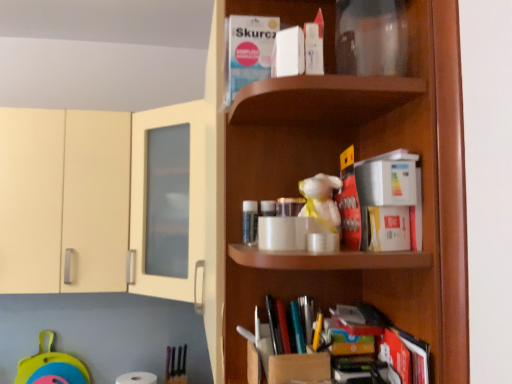
Question: Is white matte book at upper center, which is counted as the 1th book, starting from the top, shorter than multicolored plastic books at lower center, marked as the 3th book in a right-to-left arrangement?

Choices:
 (A) yes
 (B) no

Answer: (B)

Question: Could multicolored plastic books at lower center, the 4th book when ordered from top to bottom, be considered to be inside white matte book at upper center, positioned as the fifth book in bottom-to-top order?

Choices:
 (A) yes
 (B) no

Answer: (B)

Question: Does white matte book at upper center, positioned as the fifth book in bottom-to-top order, have a smaller size compared to multicolored plastic books at lower center, which ranks as the 2th book in bottom-to-top order?

Choices:
 (A) yes
 (B) no

Answer: (B)

Question: From a real-world perspective, is white matte book at upper center, which is counted as the 1th book, starting from the top, positioned under multicolored plastic books at lower center, which ranks as the 2th book in bottom-to-top order, based on gravity?

Choices:
 (A) yes
 (B) no

Answer: (B)

Question: Does white matte book at upper center, arranged as the 5th book when viewed from the right, appear on the left side of multicolored plastic books at lower center, the 4th book when ordered from top to bottom?

Choices:
 (A) no
 (B) yes

Answer: (B)

Question: Is multicolored plastic books at lower center, which ranks as the 2th book in bottom-to-top order, at the back of white matte book at upper center, arranged as the 5th book when viewed from the right?

Choices:
 (A) yes
 (B) no

Answer: (B)

Question: Can you see hardcover book at lower right, acting as the first book starting from the right, touching red matte book at center, acting as the 3th book starting from the top?

Choices:
 (A) no
 (B) yes

Answer: (A)

Question: Does hardcover book at lower right, acting as the first book starting from the right, lie behind red matte book at center, acting as the 3th book starting from the top?

Choices:
 (A) no
 (B) yes

Answer: (A)

Question: Is hardcover book at lower right, which is the fifth book in top-to-bottom order, not within red matte book at center, positioned as the second book in right-to-left order?

Choices:
 (A) no
 (B) yes

Answer: (B)

Question: Does hardcover book at lower right, which is counted as the 1th book, starting from the bottom, lie in front of red matte book at center, positioned as the second book in right-to-left order?

Choices:
 (A) no
 (B) yes

Answer: (B)

Question: Is hardcover book at lower right, acting as the first book starting from the right, wider than red matte book at center, placed as the fourth book when sorted from left to right?

Choices:
 (A) no
 (B) yes

Answer: (A)

Question: Is hardcover book at lower right, which is counted as the 1th book, starting from the bottom, facing away from red matte book at center, acting as the 3th book starting from the top?

Choices:
 (A) yes
 (B) no

Answer: (B)

Question: Could white matte book at upper center, which is the 4th book from bottom to top, be considered to be inside red matte book at center, positioned as the second book in right-to-left order?

Choices:
 (A) no
 (B) yes

Answer: (A)